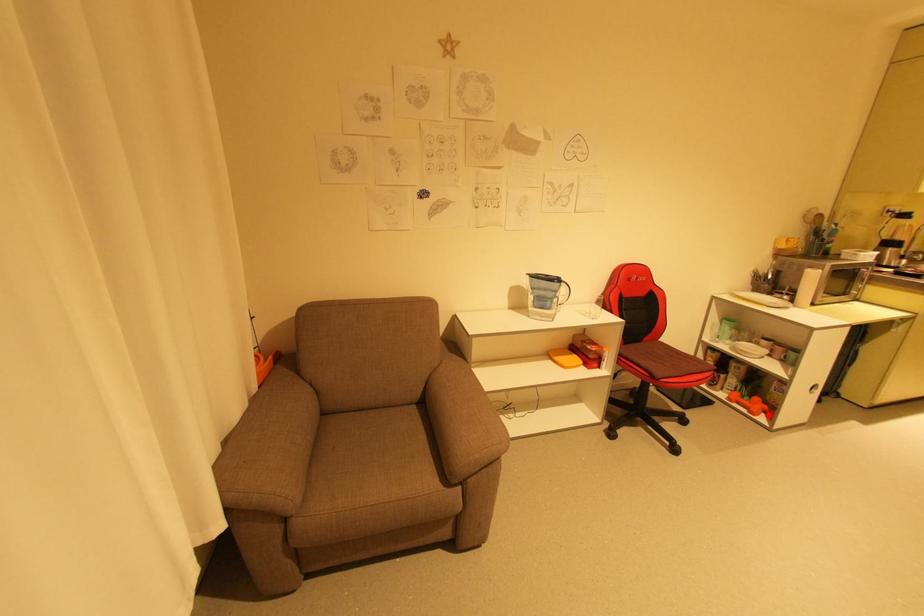
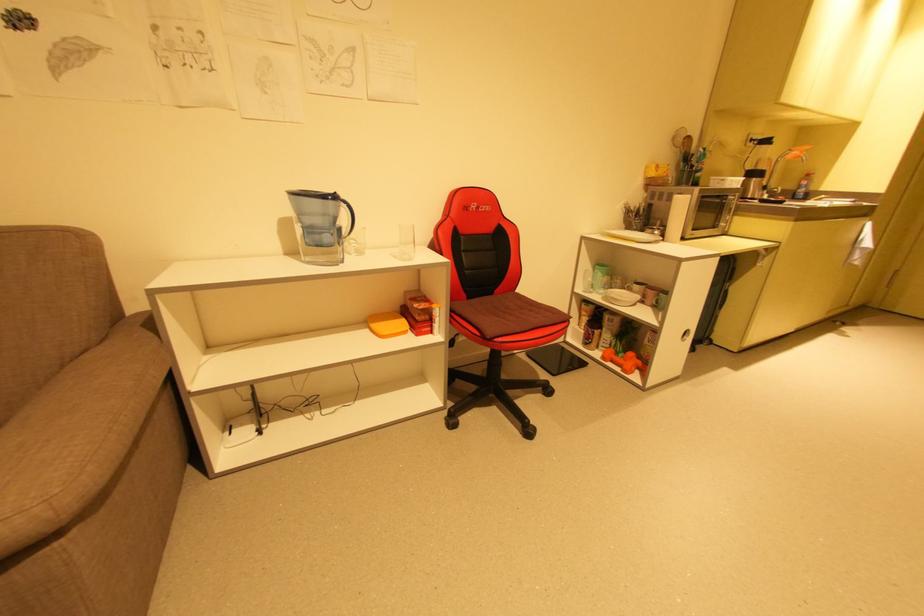
Question: I am providing you with two images of the same scene from different viewpoints. In image1, a red point is highlighted. Considering the same 3D point in image2, which of the following is correct?

Choices:
 (A) It is closer
 (B) It is farther

Answer: (A)